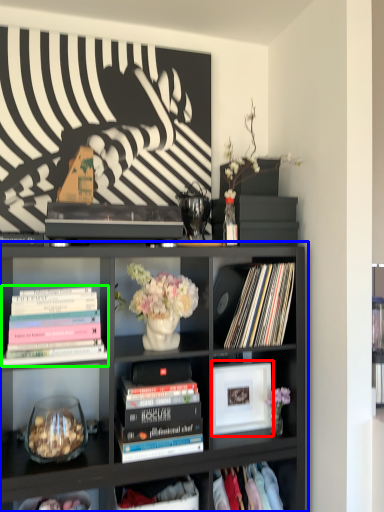
Question: Which object is the farthest from picture frame (highlighted by a red box)? Choose among these: bookcase (highlighted by a blue box) or book (highlighted by a green box).

Choices:
 (A) bookcase
 (B) book

Answer: (B)